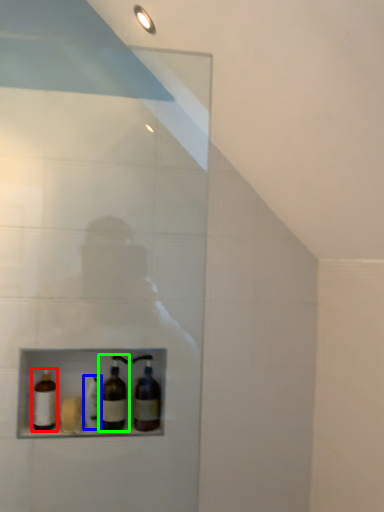
Question: Based on their relative distances, which object is farther from bottle (highlighted by a red box)? Choose from bottle (highlighted by a blue box) and bottle (highlighted by a green box).

Choices:
 (A) bottle
 (B) bottle

Answer: (B)